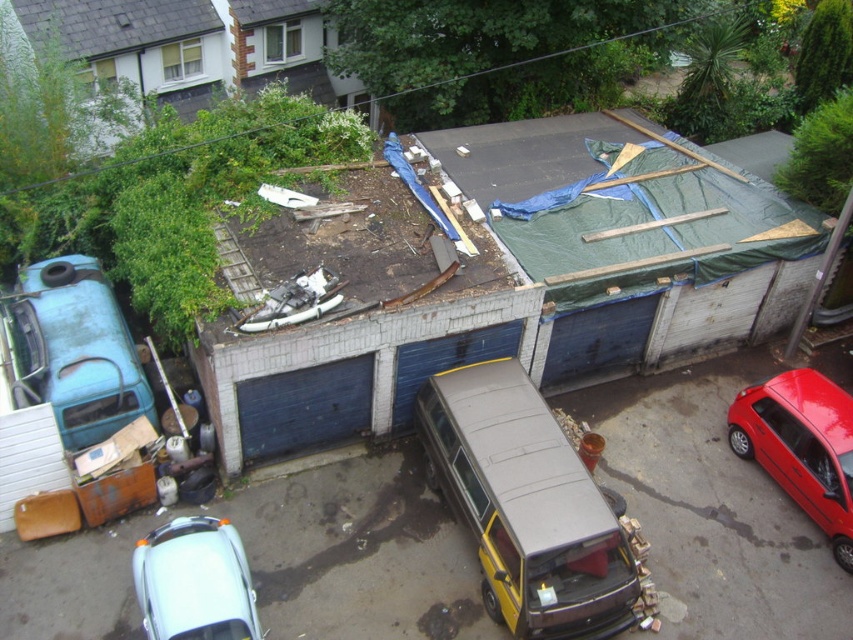
Is shiny red car at lower right thinner than white matte car at lower left?

Correct, shiny red car at lower right's width is less than white matte car at lower left's.

In order to click on shiny red car at lower right in this screenshot , I will do `click(801, 445)`.

At what (x,y) coordinates should I click in order to perform the action: click on shiny red car at lower right. Please return your answer as a coordinate pair (x, y). The height and width of the screenshot is (640, 853). Looking at the image, I should click on (801, 445).

Does yellow matte van at center have a greater height compared to rusty metal van at left?

Correct, yellow matte van at center is much taller as rusty metal van at left.

Is yellow matte van at center in front of rusty metal van at left?

Yes, yellow matte van at center is closer to the viewer.

Is point (514, 595) more distant than point (36, 346)?

No, (514, 595) is closer to viewer.

Where is `yellow matte van at center`? yellow matte van at center is located at coordinates (526, 506).

Is rusty metal van at left further to camera compared to white matte car at lower left?

That is True.

Can you confirm if rusty metal van at left is bigger than white matte car at lower left?

Yes.

Is point (96, 333) positioned after point (202, 586)?

Yes, it is behind point (202, 586).

Image resolution: width=853 pixels, height=640 pixels. Find the location of `rusty metal van at left`. rusty metal van at left is located at coordinates (74, 349).